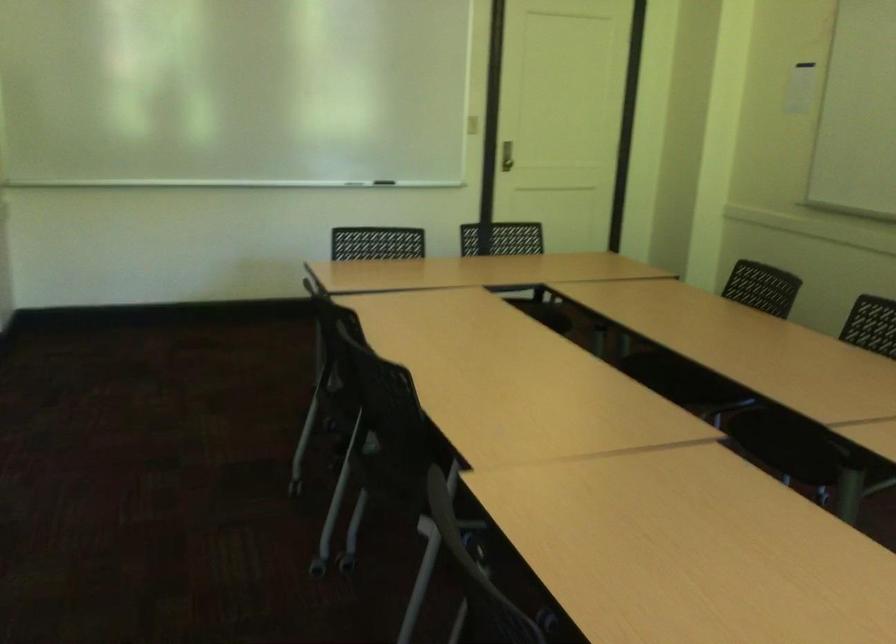
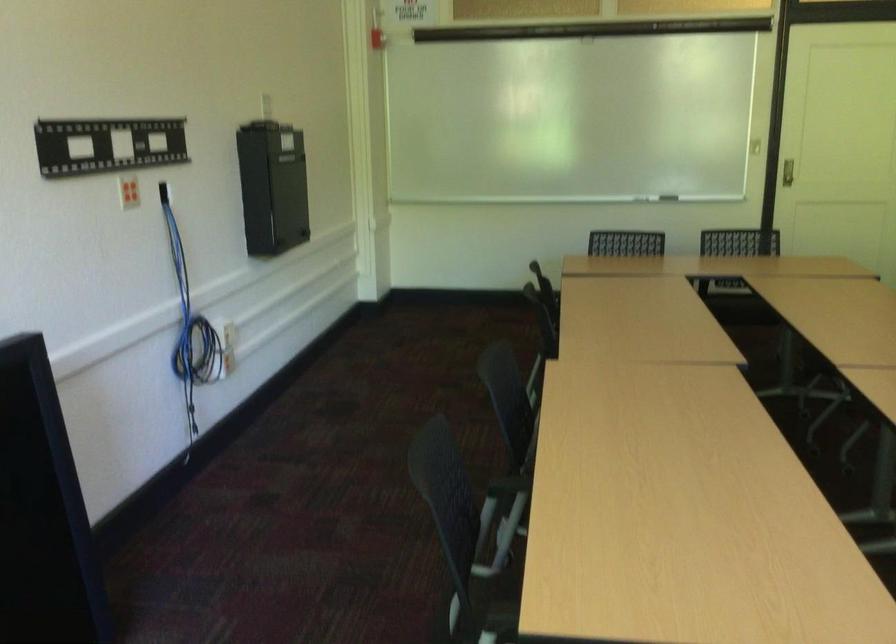
What movement of the cameraman would produce the second image?

The movement direction of the cameraman is right, backward.